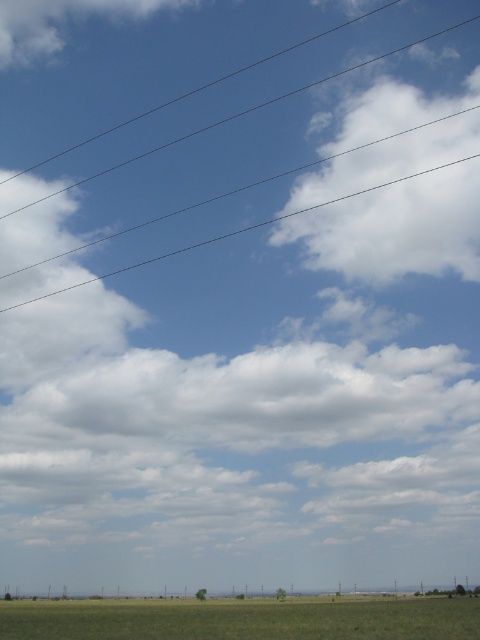
Which is in front, point (103, 276) or point (465, 589)?

Point (465, 589) is in front.

The height and width of the screenshot is (640, 480). In order to click on transparent wire at upper center in this screenshot , I will do `click(253, 184)`.

Who is positioned more to the left, green grassland at lower center or transparent wire at upper center?

Positioned to the left is transparent wire at upper center.

Does green grassland at lower center appear over transparent wire at upper center?

No.

Identify the location of green grassland at lower center. (242, 618).

Where is `green grassland at lower center`? The width and height of the screenshot is (480, 640). green grassland at lower center is located at coordinates (242, 618).

Is white fluffy cloud at upper right to the left of green grassland at lower center from the viewer's perspective?

Incorrect, white fluffy cloud at upper right is not on the left side of green grassland at lower center.

Does white fluffy cloud at upper right have a greater width compared to green grassland at lower center?

In fact, white fluffy cloud at upper right might be narrower than green grassland at lower center.

Measure the distance between white fluffy cloud at upper right and camera.

white fluffy cloud at upper right and camera are 497.16 feet apart from each other.

Find the location of `white fluffy cloud at upper right`. white fluffy cloud at upper right is located at coordinates (396, 230).